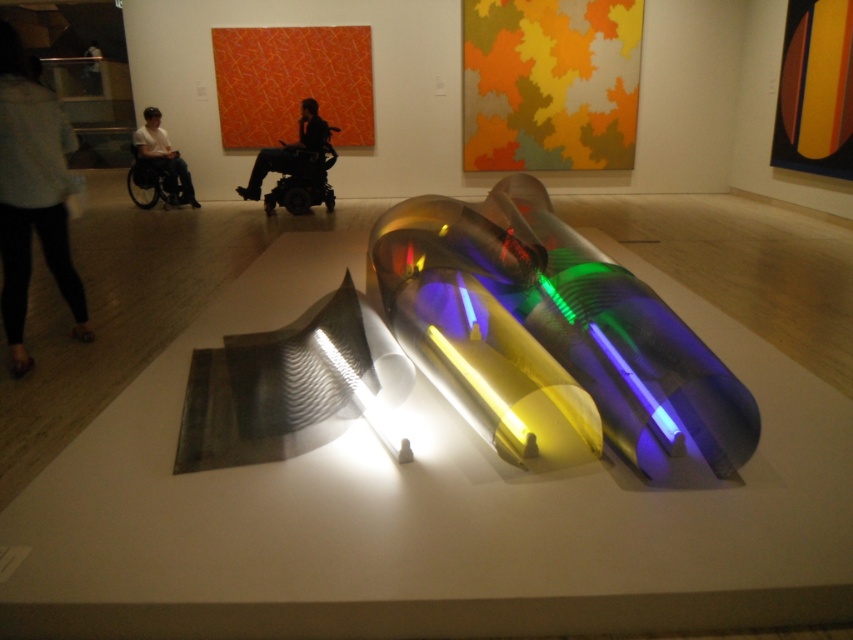
Question: Is black matte wheelchair at center wider than matte black wheelchair at left?

Choices:
 (A) yes
 (B) no

Answer: (A)

Question: Where is black matte wheelchair at center located in relation to matte black wheelchair at left in the image?

Choices:
 (A) above
 (B) below

Answer: (B)

Question: Can you confirm if light gray fabric pants at left is positioned to the left of black matte wheelchair at center?

Choices:
 (A) no
 (B) yes

Answer: (B)

Question: Considering the real-world distances, which object is farthest from the light gray fabric pants at left?

Choices:
 (A) matte black wheelchair at left
 (B) black matte wheelchair at center

Answer: (A)

Question: Which of these objects is positioned closest to the black matte wheelchair at center?

Choices:
 (A) light gray fabric pants at left
 (B) matte black wheelchair at left

Answer: (B)

Question: Among these points, which one is farthest from the camera?

Choices:
 (A) (9, 291)
 (B) (292, 157)
 (C) (186, 176)

Answer: (C)